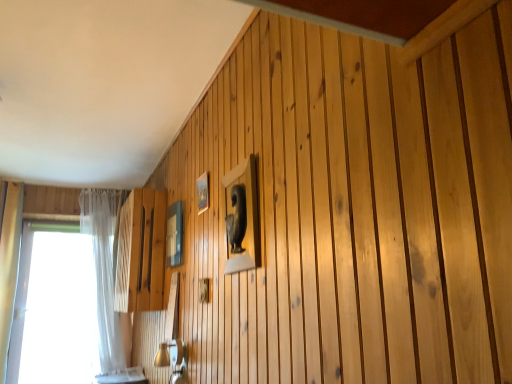
Question: Can you confirm if white sheer curtain at left is taller than matte glass picture frame at upper center, acting as the second picture frame starting from the right?

Choices:
 (A) no
 (B) yes

Answer: (B)

Question: Is white sheer curtain at left thinner than matte glass picture frame at upper center, arranged as the first picture frame when viewed from the back?

Choices:
 (A) no
 (B) yes

Answer: (A)

Question: From a real-world perspective, does white sheer curtain at left stand above matte glass picture frame at upper center, acting as the second picture frame starting from the right?

Choices:
 (A) no
 (B) yes

Answer: (A)

Question: From the image's perspective, is white sheer curtain at left under matte glass picture frame at upper center, which is the 2th picture frame in front-to-back order?

Choices:
 (A) yes
 (B) no

Answer: (A)

Question: Is white sheer curtain at left with matte glass picture frame at upper center, which ranks as the 1th picture frame in left-to-right order?

Choices:
 (A) no
 (B) yes

Answer: (A)

Question: From a real-world perspective, is transparent glass window at left above or below white sheer curtain at left?

Choices:
 (A) below
 (B) above

Answer: (A)

Question: From their relative heights in the image, would you say transparent glass window at left is taller or shorter than white sheer curtain at left?

Choices:
 (A) tall
 (B) short

Answer: (B)

Question: Is transparent glass window at left wider or thinner than white sheer curtain at left?

Choices:
 (A) thin
 (B) wide

Answer: (A)

Question: Is point (99, 304) positioned closer to the camera than point (95, 188)?

Choices:
 (A) closer
 (B) farther

Answer: (A)

Question: Is matte glass picture frame at upper center, which is the 2th picture frame in front-to-back order, wider or thinner than wooden frame at upper center, which ranks as the 2th picture frame in back-to-front order?

Choices:
 (A) thin
 (B) wide

Answer: (B)

Question: Based on their positions, is matte glass picture frame at upper center, which is the 2th picture frame in front-to-back order, located to the left or right of wooden frame at upper center, the 1th picture frame positioned from the right?

Choices:
 (A) left
 (B) right

Answer: (A)

Question: Is matte glass picture frame at upper center, which is the 2th picture frame in front-to-back order, bigger or smaller than wooden frame at upper center, the 1th picture frame positioned from the right?

Choices:
 (A) big
 (B) small

Answer: (A)

Question: Is point (179, 213) closer or farther from the camera than point (203, 173)?

Choices:
 (A) closer
 (B) farther

Answer: (B)

Question: From the image's perspective, is white sheer curtain at left positioned above or below wooden frame at upper center, the 1th picture frame positioned from the right?

Choices:
 (A) below
 (B) above

Answer: (A)

Question: Considering the positions of white sheer curtain at left and wooden frame at upper center, the 1th picture frame positioned from the front, in the image, is white sheer curtain at left wider or thinner than wooden frame at upper center, the 1th picture frame positioned from the front,?

Choices:
 (A) thin
 (B) wide

Answer: (B)